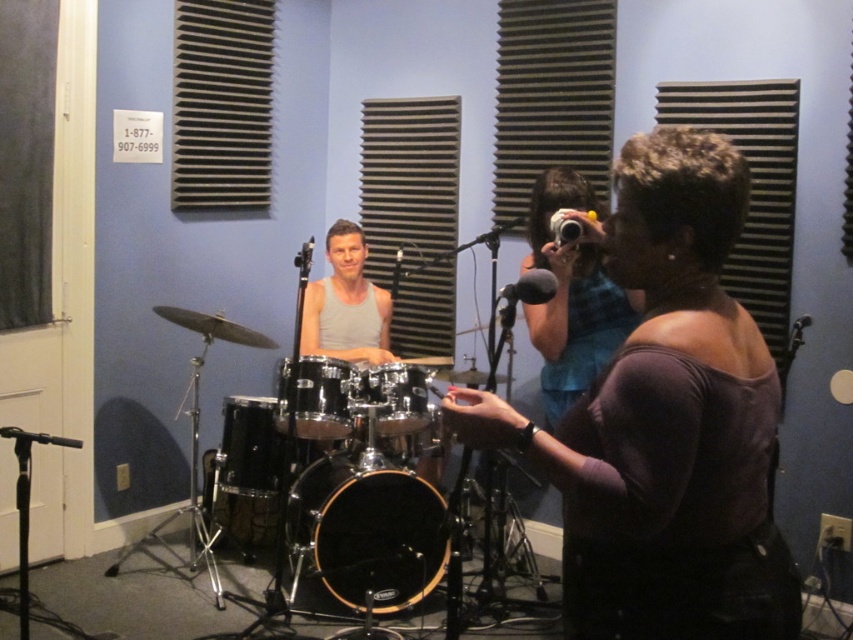
Question: Which object is farther from the camera taking this photo?

Choices:
 (A) gray tank top at center
 (B) black drum at center
 (C) dark purple fabric shirt at right

Answer: (A)

Question: Can you confirm if gray tank top at center is wider than shiny black drum at center?

Choices:
 (A) yes
 (B) no

Answer: (A)

Question: Which point is closer to the camera taking this photo?

Choices:
 (A) (73, 448)
 (B) (354, 237)
 (C) (610, 592)
 (D) (541, 278)

Answer: (C)

Question: Is gray tank top at center to the left of shiny chrome drum at center from the viewer's perspective?

Choices:
 (A) no
 (B) yes

Answer: (B)

Question: Which point is closer to the camera taking this photo?

Choices:
 (A) (683, 138)
 (B) (289, 394)

Answer: (A)

Question: Is the position of shiny chrome drum at center more distant than that of black matte microphone at center?

Choices:
 (A) no
 (B) yes

Answer: (B)